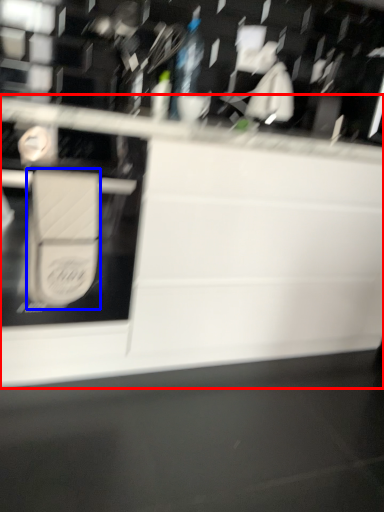
Question: Among these objects, which one is nearest to the camera, countertop (highlighted by a red box) or wide (highlighted by a blue box)?

Choices:
 (A) countertop
 (B) wide

Answer: (A)